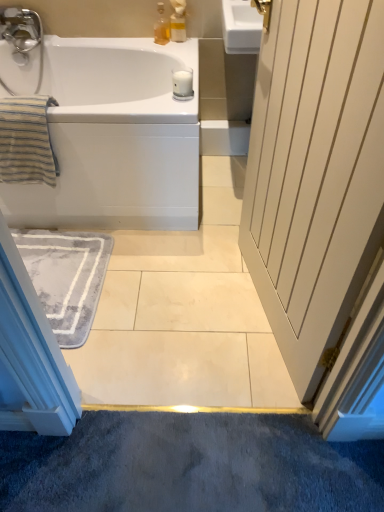
Locate an element on the screen. Image resolution: width=384 pixels, height=512 pixels. vacant space that is to the left of translucent plastic bottle at upper center is located at coordinates (141, 41).